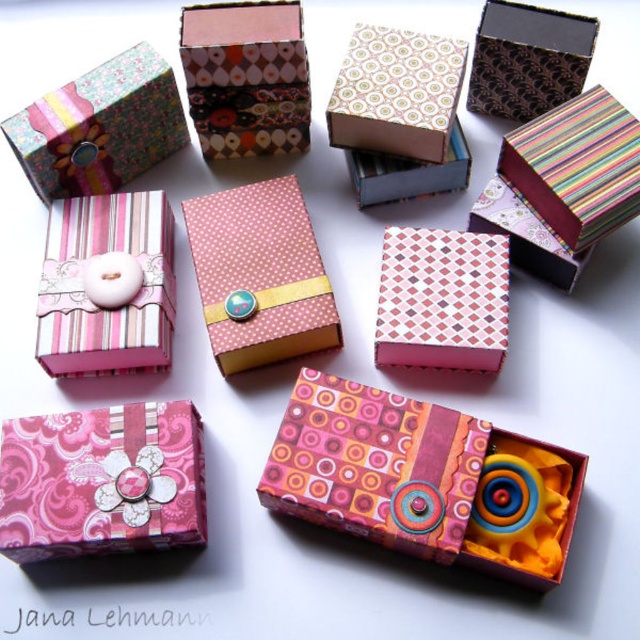
You have two boxes in front of you on a table. The pink dotted paper gift box at center and the matte pink paper box at center. You want to place both boxes into a storage container that can only fit the smaller of the two. Which box should you choose?

The matte pink paper box at center should be chosen because its width is smaller than the pink dotted paper gift box at center, making it the smaller box that can fit into the storage container.

You are a delivery person who needs to place a 30 inch long package between the matte pink paper gift box at upper left and the multicolored striped gift box at upper right. Can the package fit between them?

Answer: The distance between the matte pink paper gift box at upper left and the multicolored striped gift box at upper right is 32.07 inches. Since the package is 30 inches long, it can fit between them as there is enough space.

You are organizing a gift wrapping station and need to place a ribbon spool that is 26 centimeters in diameter between the pink dotted paper gift box at center and the matte pink paper box at center. Will the spool fit between them without overlapping?

The distance between the pink dotted paper gift box at center and the matte pink paper box at center is 25.60 centimeters. Since the ribbon spool is 26 centimeters in diameter, it is slightly larger than the space available. Therefore, the spool will not fit between them without overlapping.